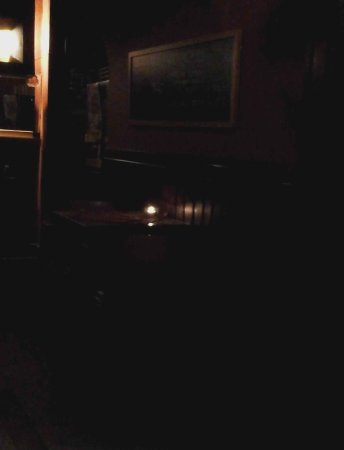
Locate an element on the screen. This screenshot has width=344, height=450. doorway is located at coordinates (44, 65).